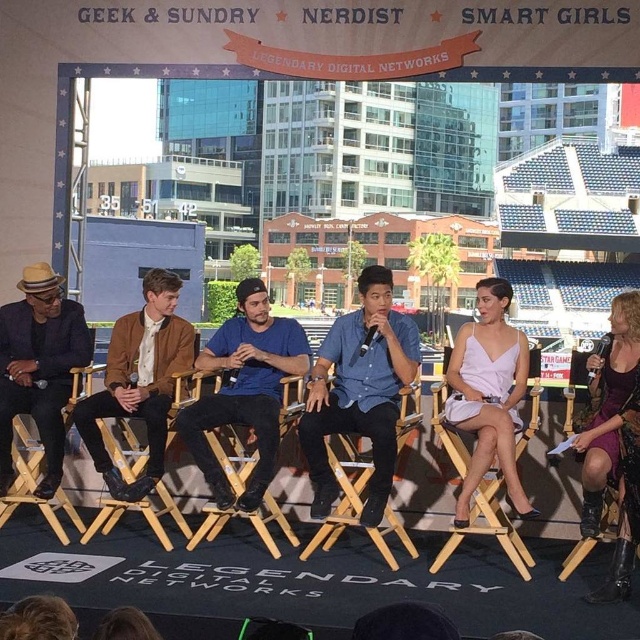
Can you confirm if blue denim shirt at center is bigger than wooden chair at center?

Indeed, blue denim shirt at center has a larger size compared to wooden chair at center.

Is blue denim shirt at center closer to camera compared to wooden chair at center?

Yes.

Which is behind, point (381, 486) or point (284, 413)?

The point (284, 413) is behind.

Where is `blue denim shirt at center`? The width and height of the screenshot is (640, 640). blue denim shirt at center is located at coordinates click(358, 392).

Is point (353, 353) positioned behind point (0, 403)?

Yes, it is.

Consider the image. Who is positioned more to the left, blue denim shirt at center or matte black suit at left?

From the viewer's perspective, matte black suit at left appears more on the left side.

Is point (316, 422) farther from camera compared to point (19, 403)?

No.

Where is `blue denim shirt at center`? This screenshot has height=640, width=640. blue denim shirt at center is located at coordinates pos(358,392).

You are a GUI agent. You are given a task and a screenshot of the screen. Output one action in this format:
    pyautogui.click(x=<x>, y=<y>)
    Task: Click on the matte black suit at left
    Image resolution: width=640 pixels, height=640 pixels.
    Given the screenshot: What is the action you would take?
    pyautogui.click(x=38, y=369)

Is matte black suit at left bigger than brown leather jacket at center?

No.

Which is behind, point (54, 458) or point (145, 275)?

The point (145, 275) is more distant.

Image resolution: width=640 pixels, height=640 pixels. Find the location of `matte black suit at left`. matte black suit at left is located at coordinates (38, 369).